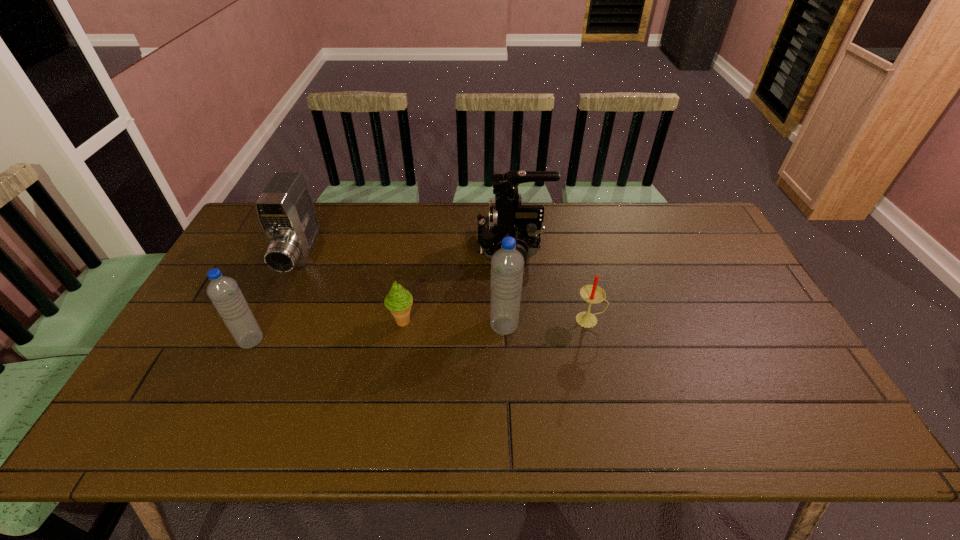
You are a GUI agent. You are given a task and a screenshot of the screen. Output one action in this format:
    pyautogui.click(x=<x>, y=<y>)
    Task: Click on the free spot between the shorter water bottle and the shorter camcorder
    This screenshot has height=540, width=960.
    Given the screenshot: What is the action you would take?
    pyautogui.click(x=276, y=298)

Image resolution: width=960 pixels, height=540 pixels. In order to click on empty location between the rightmost object and the right camcorder in this screenshot , I will do `click(551, 284)`.

Find the location of `free space that is in between the taller water bottle and the icecream`. free space that is in between the taller water bottle and the icecream is located at coordinates (453, 323).

The height and width of the screenshot is (540, 960). What are the coordinates of `free space between the right water bottle and the third object from left to right` in the screenshot? It's located at (453, 323).

The image size is (960, 540). In order to click on free area in between the left water bottle and the right water bottle in this screenshot , I will do `click(377, 333)`.

The width and height of the screenshot is (960, 540). Identify the location of free space between the left camcorder and the left water bottle. (276, 298).

Where is `blank region between the left camcorder and the left water bottle`? The height and width of the screenshot is (540, 960). blank region between the left camcorder and the left water bottle is located at coordinates (276, 298).

Image resolution: width=960 pixels, height=540 pixels. Find the location of `object that is the fourth closest to the left water bottle`. object that is the fourth closest to the left water bottle is located at coordinates pyautogui.click(x=507, y=217).

Where is `object that is the fourth closest to the icecream`? Image resolution: width=960 pixels, height=540 pixels. object that is the fourth closest to the icecream is located at coordinates (224, 292).

Where is `vacant position in the image that satisfies the following two spatial constraints: 1. at the front of the candle, highlighting the lens; 2. on the left side of the shorter camcorder`? The height and width of the screenshot is (540, 960). vacant position in the image that satisfies the following two spatial constraints: 1. at the front of the candle, highlighting the lens; 2. on the left side of the shorter camcorder is located at coordinates [271, 320].